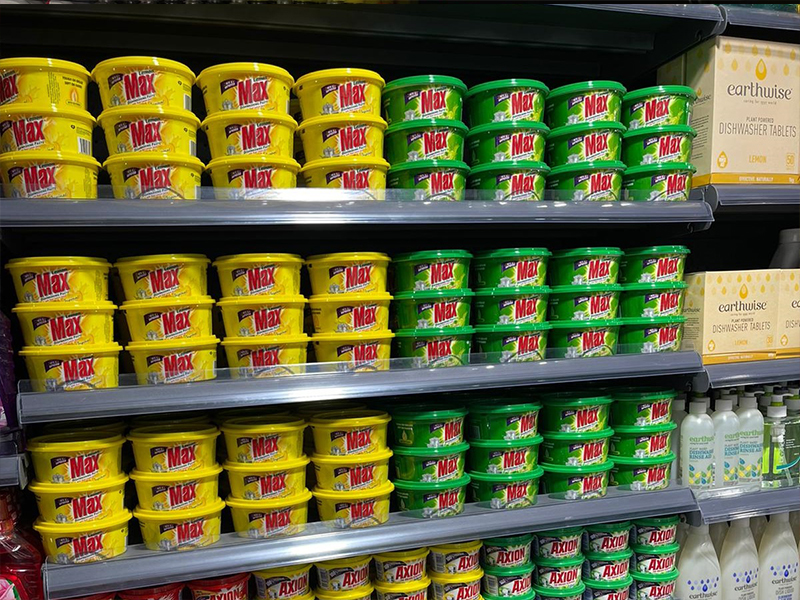
This screenshot has width=800, height=600. In order to click on bottles in this screenshot , I will do `click(745, 464)`, `click(745, 575)`.